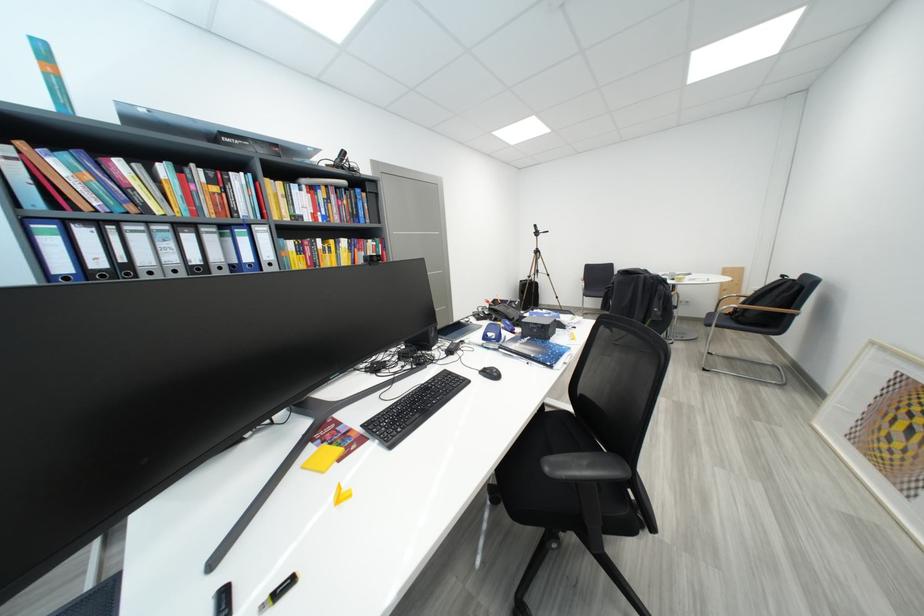
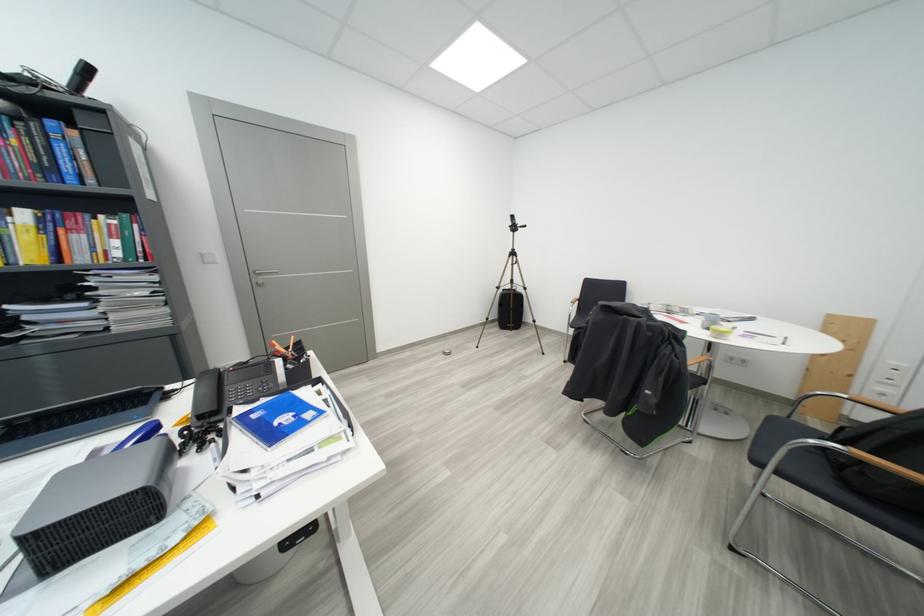
Where in the second image is the point corresponding to [538,280] from the first image?

(506, 291)